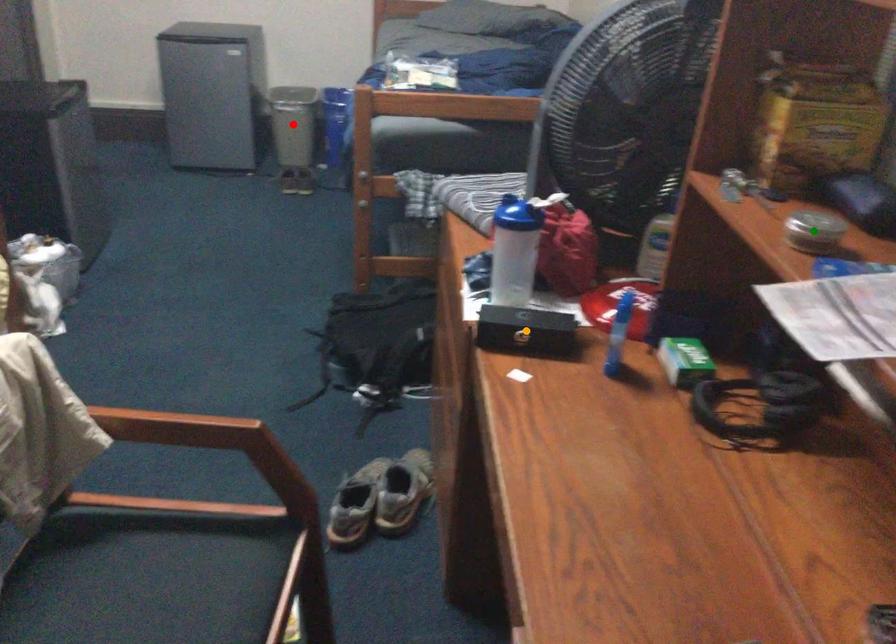
Based on the photo, order these from nearest to farthest:
1. red point
2. orange point
3. green point

1. green point
2. orange point
3. red point